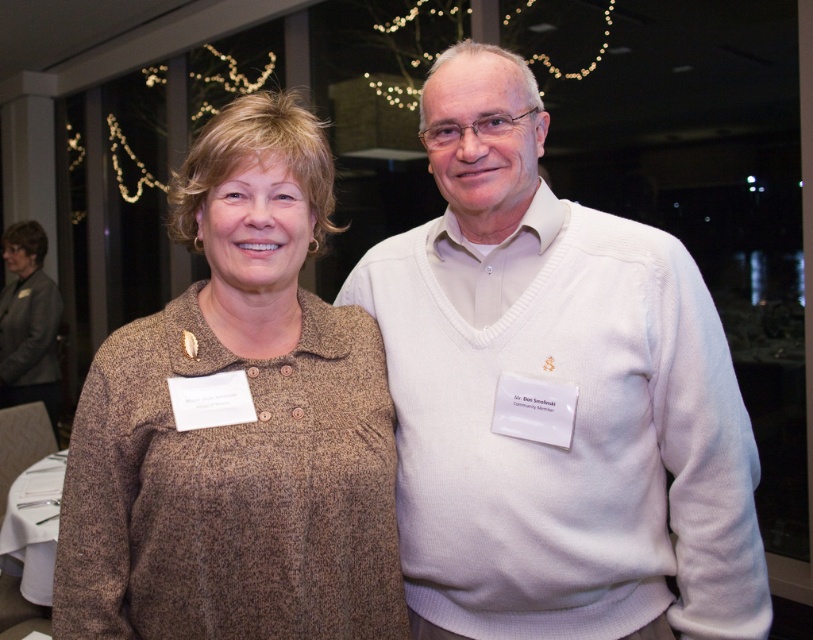
You are organizing a clothing donation drive and need to determine if two sweaters can fit side by side on a 1.2 meter wide display shelf. The sweaters are the white knit sweater at center and the brown woolen sweater at center. Based on their widths, will both fit?

The white knit sweater at center might be wider than the brown woolen sweater at center. If the combined width of both sweaters exceeds 1.2 meters, they may not fit. However, without exact measurements, it is uncertain. Please measure both sweaters to confirm.

You are at a networking event and notice two people standing together. You see a white knit sweater at center and a brown woolen sweater at center. Which sweater is closer to you?

The white knit sweater at center is closer to you because the brown woolen sweater at center is behind it.